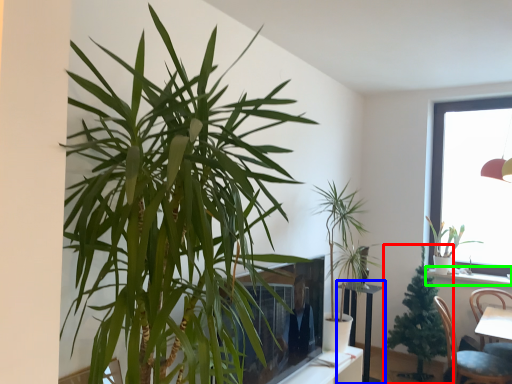
Question: Considering the real-world distances, which object is closest to houseplant (highlighted by a red box)? round table (highlighted by a blue box) or window sill (highlighted by a green box).

Choices:
 (A) round table
 (B) window sill

Answer: (A)